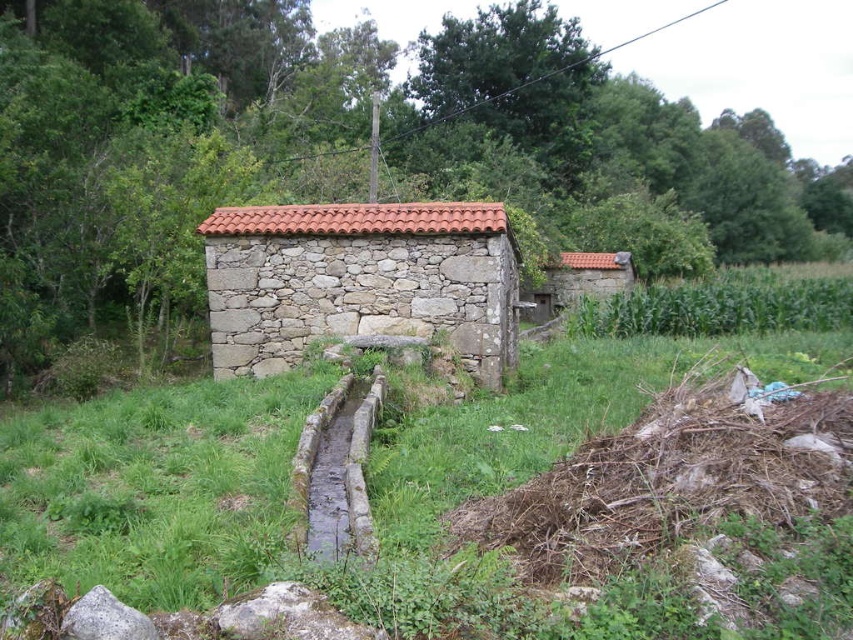
Question: Which object is closer to the camera taking this photo?

Choices:
 (A) stone textured hut at center
 (B) green grassy corn field at right

Answer: (A)

Question: Which point is closer to the camera taking this photo?

Choices:
 (A) click(740, 282)
 (B) click(224, 282)

Answer: (B)

Question: Does stone textured hut at center have a lesser width compared to green grassy corn field at right?

Choices:
 (A) yes
 (B) no

Answer: (A)

Question: Can you confirm if stone textured hut at center is bigger than green grassy corn field at right?

Choices:
 (A) no
 (B) yes

Answer: (A)

Question: Can you confirm if stone textured hut at center is smaller than green grassy corn field at right?

Choices:
 (A) no
 (B) yes

Answer: (B)